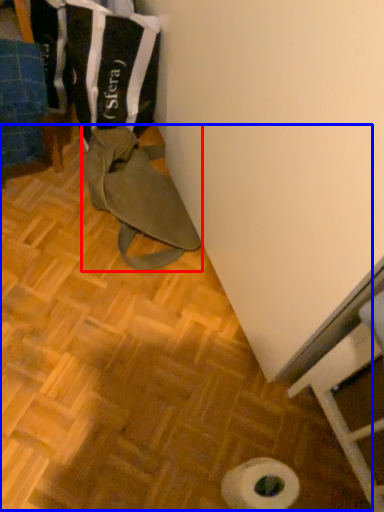
Question: Which of the following is the closest to the observer, wide (highlighted by a red box) or wood (highlighted by a blue box)?

Choices:
 (A) wide
 (B) wood

Answer: (B)